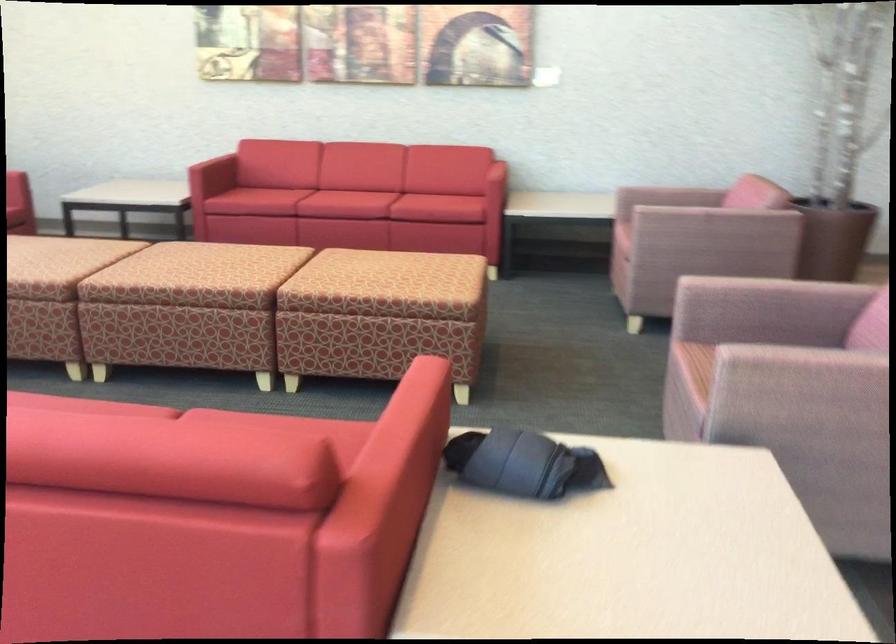
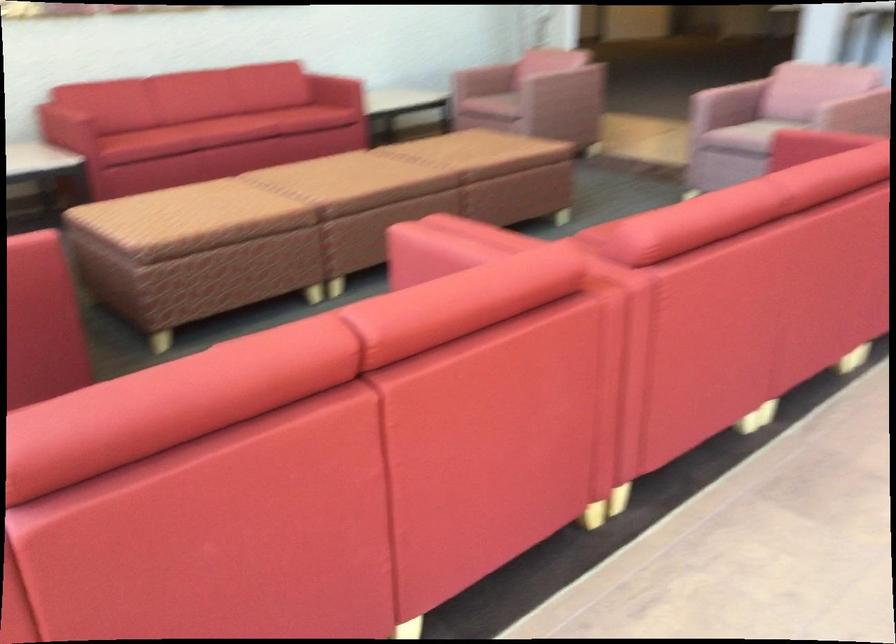
Find the pixel in the second image that matches (385,270) in the first image.

(481, 152)